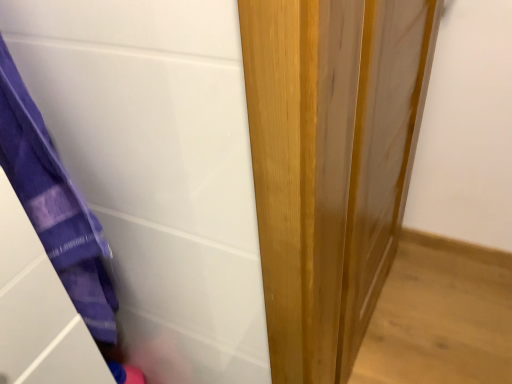
Question: Is purple fabric at left touching wooden door at center?

Choices:
 (A) no
 (B) yes

Answer: (A)

Question: Could you tell me if purple fabric at left is facing wooden door at center?

Choices:
 (A) yes
 (B) no

Answer: (B)

Question: Is purple fabric at left positioned beyond the bounds of wooden door at center?

Choices:
 (A) no
 (B) yes

Answer: (B)

Question: Is purple fabric at left closer to camera compared to wooden door at center?

Choices:
 (A) yes
 (B) no

Answer: (A)

Question: Is purple fabric at left at the left side of wooden door at center?

Choices:
 (A) no
 (B) yes

Answer: (B)

Question: Is purple fabric at left further to the viewer compared to wooden door at center?

Choices:
 (A) yes
 (B) no

Answer: (B)

Question: From the image's perspective, is wooden door at center located beneath purple fabric at left?

Choices:
 (A) no
 (B) yes

Answer: (A)

Question: Is purple fabric at left surrounded by wooden door at center?

Choices:
 (A) yes
 (B) no

Answer: (B)

Question: Considering the relative sizes of wooden door at center and purple fabric at left in the image provided, is wooden door at center bigger than purple fabric at left?

Choices:
 (A) no
 (B) yes

Answer: (B)

Question: Is wooden door at center smaller than purple fabric at left?

Choices:
 (A) no
 (B) yes

Answer: (A)

Question: Considering the relative sizes of wooden door at center and purple fabric at left in the image provided, is wooden door at center taller than purple fabric at left?

Choices:
 (A) yes
 (B) no

Answer: (A)

Question: Is wooden door at center thinner than purple fabric at left?

Choices:
 (A) yes
 (B) no

Answer: (A)

Question: Is purple fabric at left bigger or smaller than wooden door at center?

Choices:
 (A) big
 (B) small

Answer: (B)